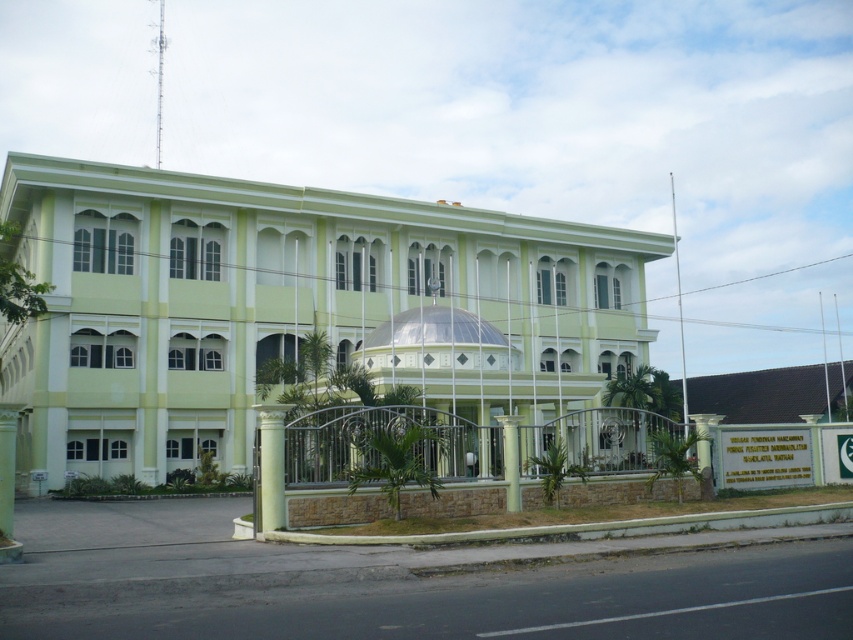
Looking at this image, you are standing in front of the building and want to walk towards the light green concrete building at center. Which direction should you move relative to the green polished stone column at center?

You should move to the right of the green polished stone column at center because the light green concrete building at center is located to its right.

You are standing in front of a camera that is pointed towards the light green concrete building at center. If the camera has a focal length of 50mm and you want to capture the entire building in one shot without moving the camera, what is the minimum sensor width required in millimeters?

The light green concrete building at center and camera are 17.82 meters apart. To calculate the minimum sensor width required, use the formula sensor width needed equals twice the building width multiplied by focal length divided by distance. However, since the building width isn not provided, it cannot be determined with the given information.

You are a city planner evaluating the space in front of the light green concrete building at center and the white marble pillar at center. Given that the pillar is smaller, can you estimate how much space is available between them for pedestrians to walk comfortably?

The light green concrete building at center is larger in size than the white marble pillar at center, but the exact distance between them isn not provided in the description. Without specific measurements, it is impossible to determine the available space for pedestrians.